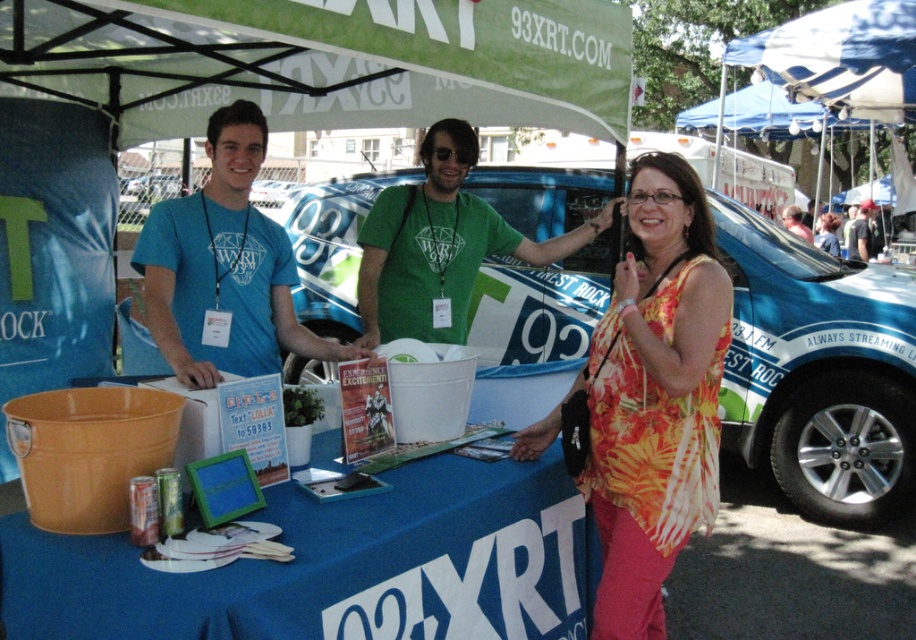
You are attending an outdoor event and notice the green fabric canopy at upper center and the green matte shirt at center. Which object is bigger in size?

The green fabric canopy at upper center is larger in size than the green matte shirt at center.

What are the coordinates of the blue metallic car at center?

The blue metallic car at center is located at coordinates point (818, 371).

You are a photographer at the 93XRT event booth. You need to place a new promotional banner between the blue metallic car at center and the blue fabric tablecloth at center. Which object should the banner be placed closer to if it needs to be wider than the narrower object?

The blue metallic car at center is thinner than the blue fabric tablecloth at center. Therefore, the banner should be placed closer to the blue metallic car at center to ensure it is wider than the narrower object.